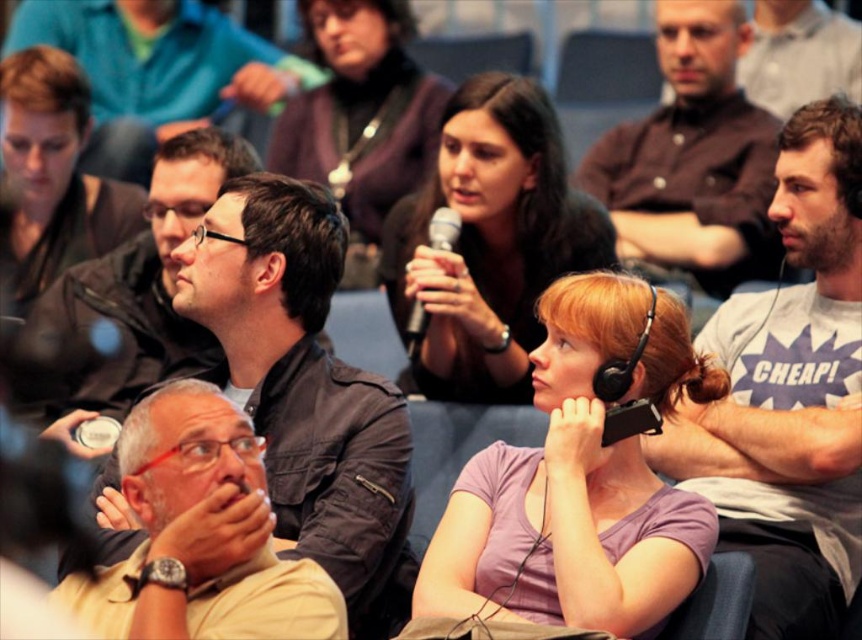
Who is more forward, (130, 131) or (166, 154)?

Positioned in front is point (166, 154).

Who is lower down, matte black shirt at upper center or matte black jacket at center?

matte black jacket at center is lower down.

Describe the element at coordinates (155, 70) in the screenshot. The height and width of the screenshot is (640, 862). I see `matte black shirt at upper center` at that location.

Image resolution: width=862 pixels, height=640 pixels. I want to click on matte black shirt at upper center, so click(155, 70).

Who is higher up, purple matte shirt at center or matte purple shirt at center?

matte purple shirt at center is above.

Between purple matte shirt at center and matte purple shirt at center, which one appears on the right side from the viewer's perspective?

From the viewer's perspective, purple matte shirt at center appears more on the right side.

The image size is (862, 640). I want to click on purple matte shirt at center, so click(x=579, y=483).

Is tan fabric shirt at lower left positioned in front of metallic silver microphone at center?

Yes, it is.

From the picture: Can you confirm if tan fabric shirt at lower left is shorter than metallic silver microphone at center?

No, tan fabric shirt at lower left is not shorter than metallic silver microphone at center.

Is point (334, 592) less distant than point (408, 332)?

Yes, point (334, 592) is closer to viewer.

This screenshot has height=640, width=862. What are the coordinates of `tan fabric shirt at lower left` in the screenshot? It's located at (200, 534).